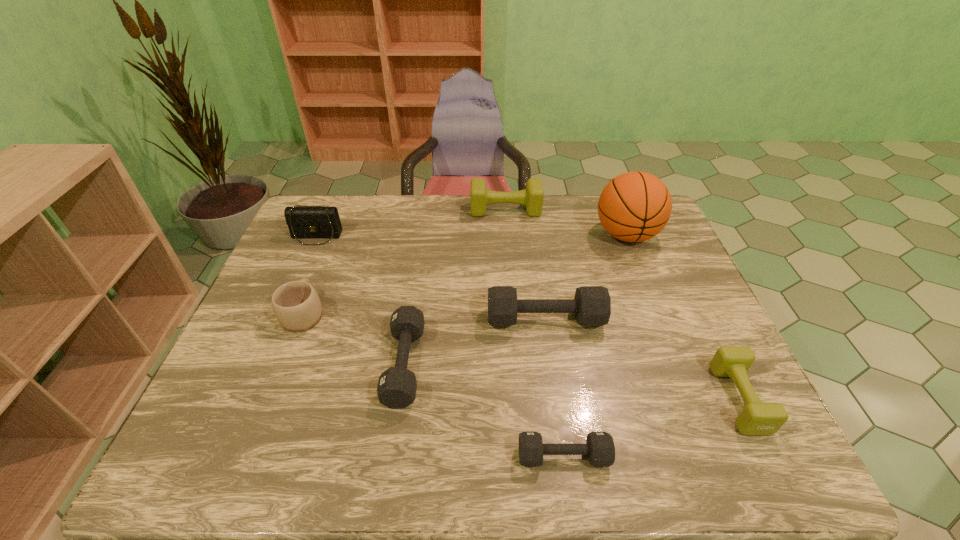
Where is `empty space that is in between the biggest gray dumbbell and the nearer olive dumbbell`? This screenshot has height=540, width=960. empty space that is in between the biggest gray dumbbell and the nearer olive dumbbell is located at coordinates (642, 359).

Find the location of `unoccupied position between the clutch bag and the mug`. unoccupied position between the clutch bag and the mug is located at coordinates (310, 275).

This screenshot has height=540, width=960. Find the location of `free space between the biggest gray dumbbell and the farthest dumbbell`. free space between the biggest gray dumbbell and the farthest dumbbell is located at coordinates (x=525, y=265).

The height and width of the screenshot is (540, 960). I want to click on free space that is in between the second biggest gray dumbbell and the left olive dumbbell, so click(455, 287).

Where is `free spot between the bigger olive dumbbell and the right olive dumbbell`? This screenshot has width=960, height=540. free spot between the bigger olive dumbbell and the right olive dumbbell is located at coordinates (622, 305).

Identify the location of free space between the left olive dumbbell and the mug. (404, 261).

Find the location of a particular element. The image size is (960, 540). vacant region between the orange basketball and the mug is located at coordinates (465, 274).

At what (x,y) coordinates should I click in order to perform the action: click on object that is the sixth closest to the nearest dumbbell. Please return your answer as a coordinate pair (x, y). The height and width of the screenshot is (540, 960). Looking at the image, I should click on (x=532, y=197).

Where is `the second closest object to the basketball`? the second closest object to the basketball is located at coordinates (592, 304).

This screenshot has height=540, width=960. I want to click on dumbbell that is the second closest to the bigger olive dumbbell, so click(397, 386).